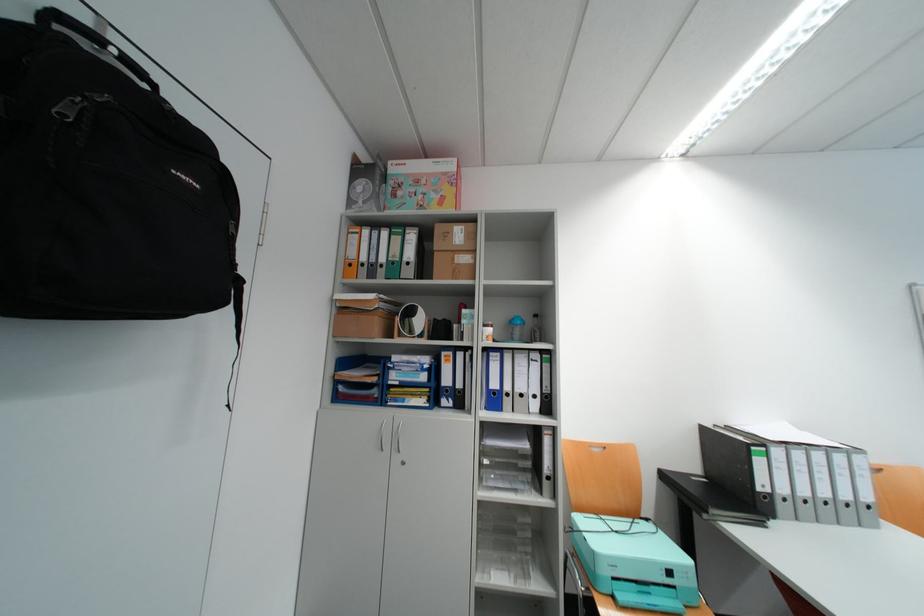
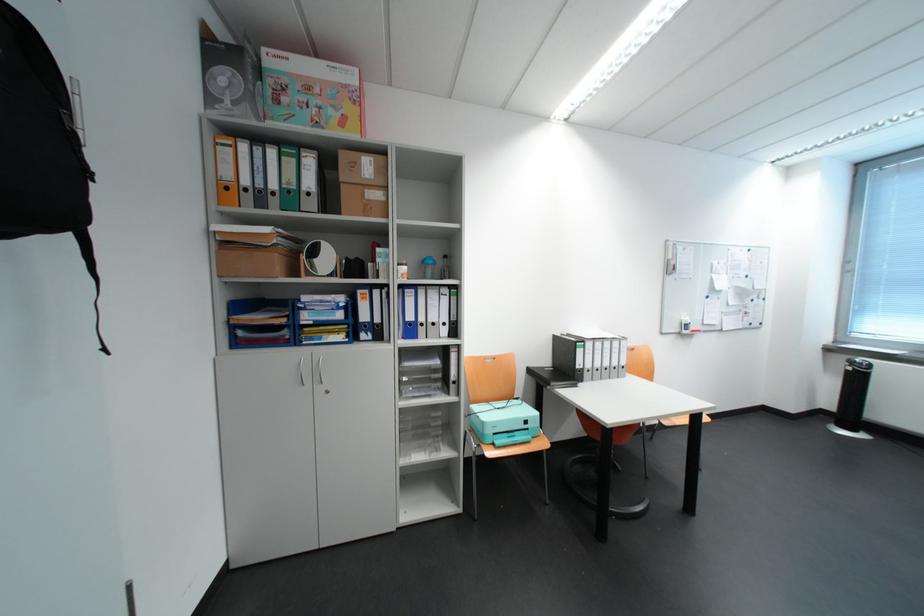
In the second image, find the point that corresponds to pixel 354 246 in the first image.

(221, 160)